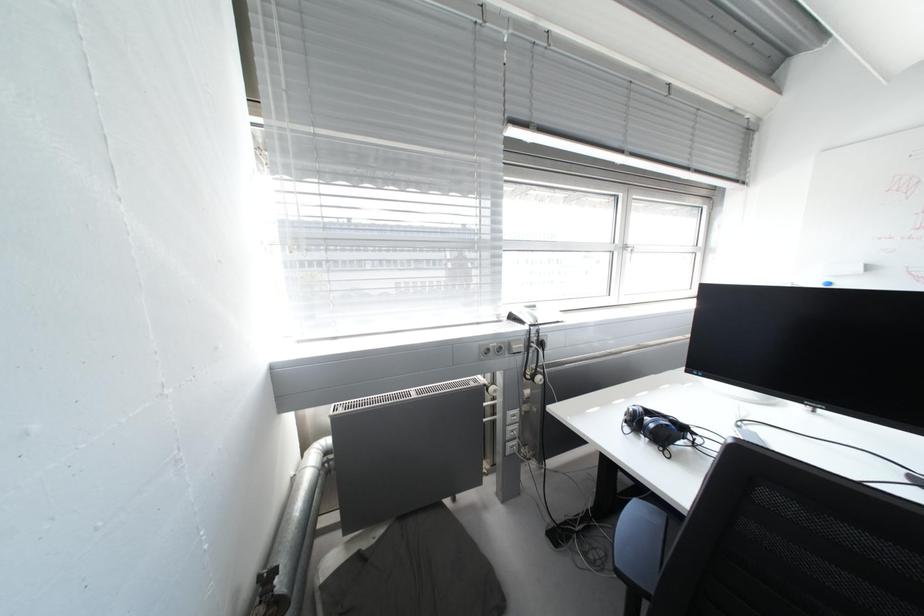
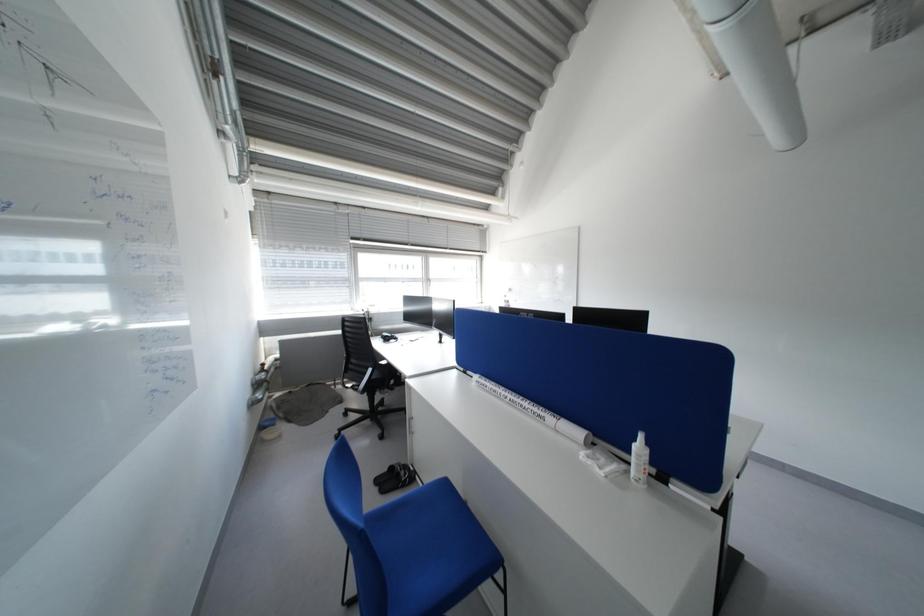
Consider the image. In a continuous first-person perspective shot, in which direction is the camera moving?

The cameraman walked toward right, backward.